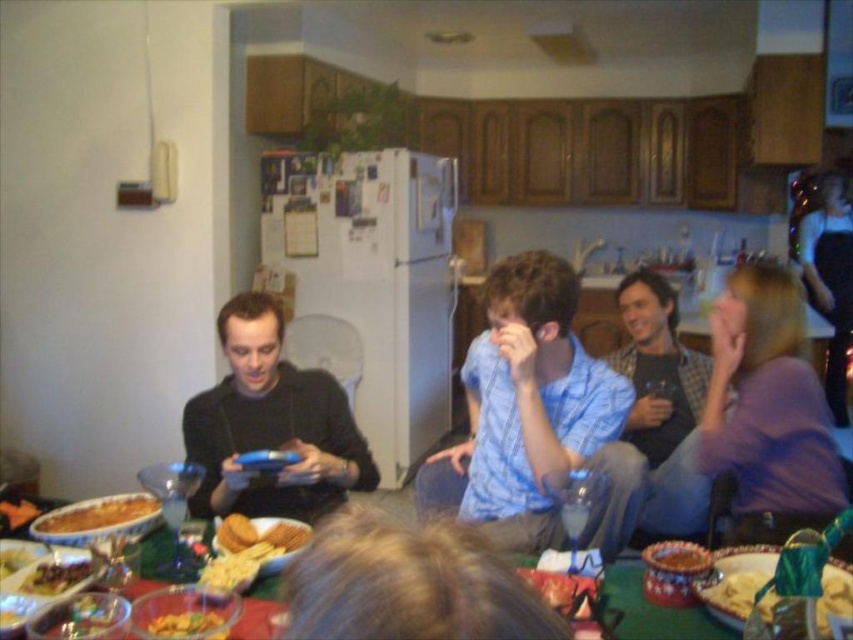
Consider the image. You are standing in the kitchen and want to reach the green felt table at lower center. There is a black matte shirt at center in your way. Which object is closer to you, making it an obstacle?

The black matte shirt at center is closer to you than the green felt table at lower center, so it is the obstacle in your path.

You are a guest at this gathering and want to place a small plate on the green felt table at lower center. However, you notice the black matte shirt at center is covering part of it. Can you still place the plate there without moving the shirt?

The black matte shirt at center is bigger than the green felt table at lower center, so it likely covers most of the table. You may not have enough space to place the plate without moving the shirt.

You are a guest at this gathering and want to place a small note on the table without covering any food items. Given the light blue shirt at center and the golden crispy chips at center, which object should you avoid placing the note over to ensure it doesn

The light blue shirt at center has a larger size compared to golden crispy chips at center, so you should avoid placing the note over the light blue shirt at center to ensure it doesn